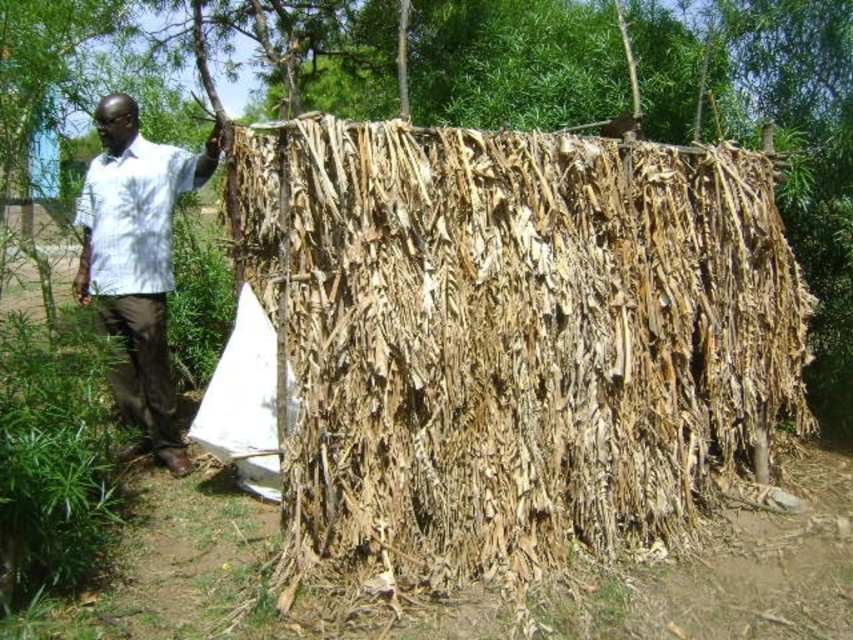
You are a photographer trying to capture the man in the white shirt at left and the white textured shirt at left. Since both shirts are white, which one would be easier to see in the photo?

The white shirt at left is in front of the white textured shirt at left, so it would be easier to see in the photo because it is closer to the camera.

You are a visitor at a rural fair and see the brown dried leaves at center and the white shirt at left. Which object is positioned more to the east in the scene?

The brown dried leaves at center are to the right of the white shirt at left, so the brown dried leaves at center are positioned more to the east.

You are a photographer trying to capture the man in the white shirt at left and the white textured shirt at left. Which shirt is closer to the camera?

The white shirt at left is positioned under the white textured shirt at left, so the white textured shirt at left is closer to the camera.